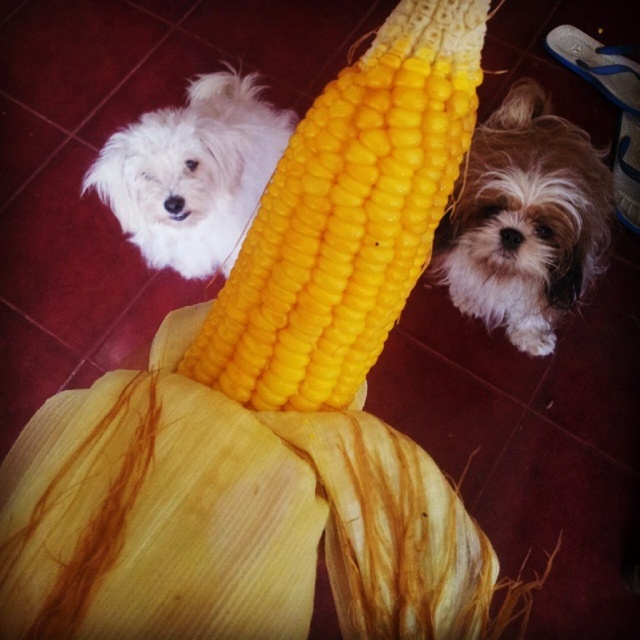
Question: Which point appears closest to the camera in this image?

Choices:
 (A) (278, 243)
 (B) (177, 448)
 (C) (548, 339)
 (D) (109, 140)

Answer: (B)

Question: Is yellow corn at center wider than yellow matte corn at center?

Choices:
 (A) yes
 (B) no

Answer: (A)

Question: Which point is farther to the camera?

Choices:
 (A) fuzzy brown dog at lower right
 (B) yellow matte corn at center

Answer: (A)

Question: In this image, where is fuzzy brown dog at lower right located relative to white fluffy dog at upper left?

Choices:
 (A) below
 (B) above

Answer: (A)

Question: Which of the following is the closest to the observer?

Choices:
 (A) (593, 266)
 (B) (276, 157)
 (C) (300, 442)
 (D) (412, 67)

Answer: (D)

Question: Is yellow matte corn at center closer to the viewer compared to white fluffy dog at upper left?

Choices:
 (A) yes
 (B) no

Answer: (A)